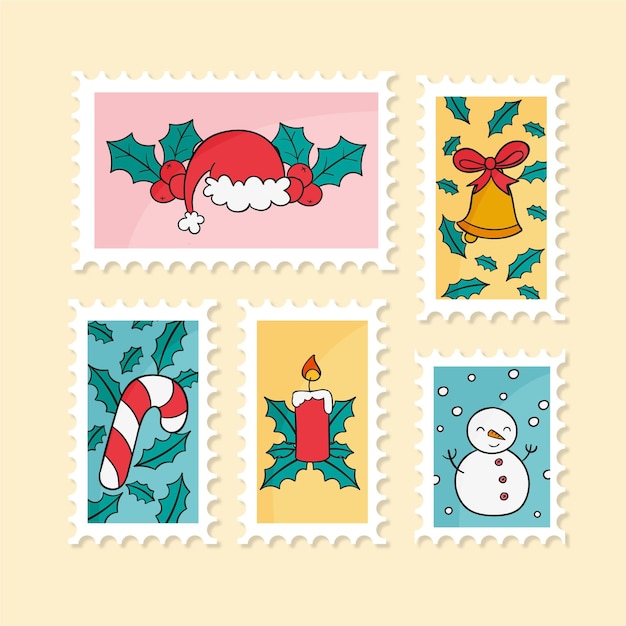
What are the coordinates of `candle` in the screenshot? It's located at (312, 446).